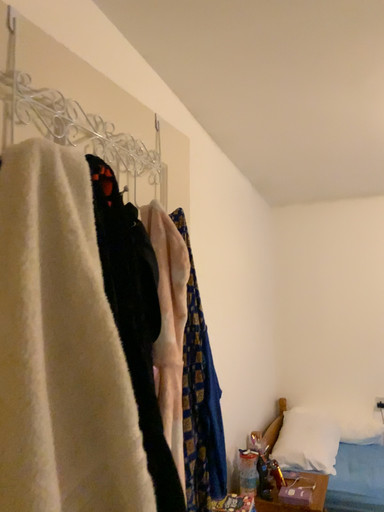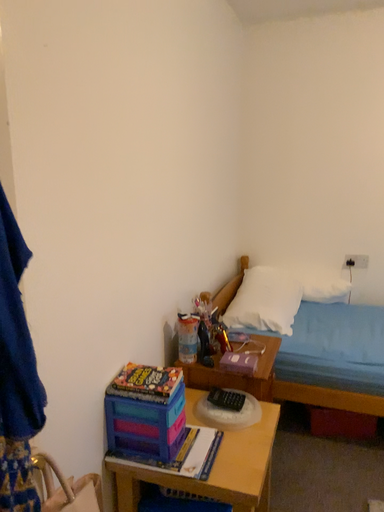
Question: Which way did the camera rotate in the video?

Choices:
 (A) rotated upward
 (B) rotated downward

Answer: (B)